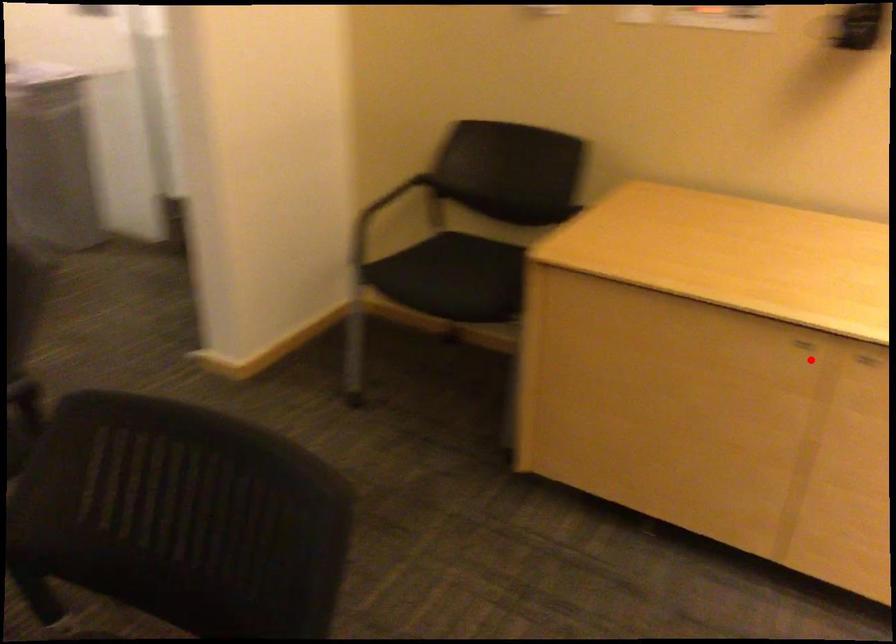
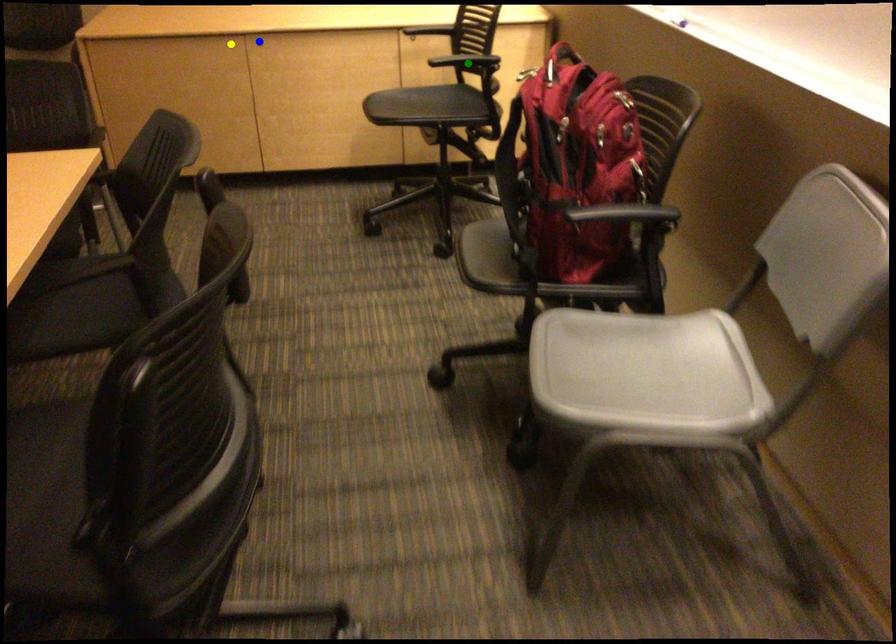
Question: I am providing you with two images of the same scene from different viewpoints. A red point is marked on the first image. You are given multiple points on the second image. Which spot in image 2 lines up with the point in image 1?

Choices:
 (A) yellow point
 (B) blue point
 (C) green point

Answer: (A)